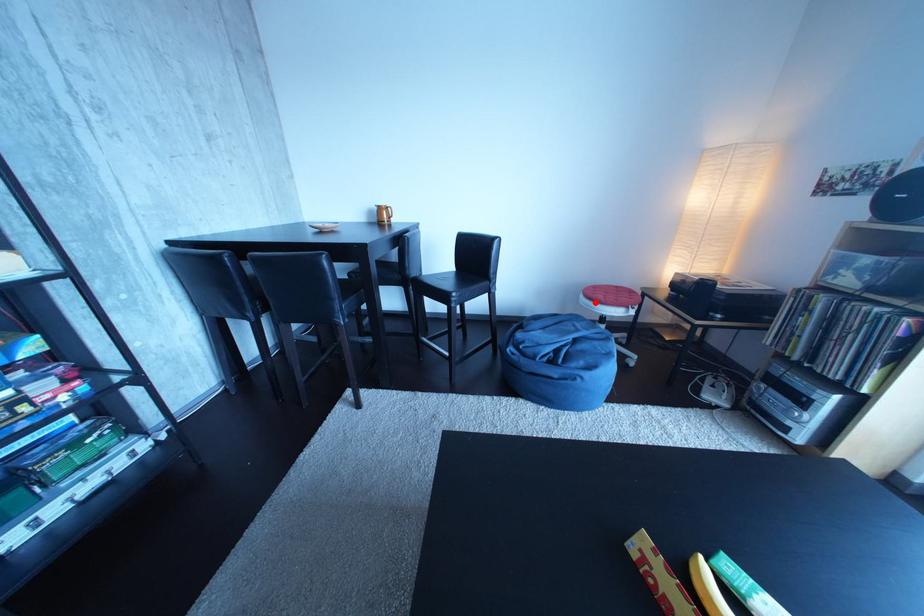
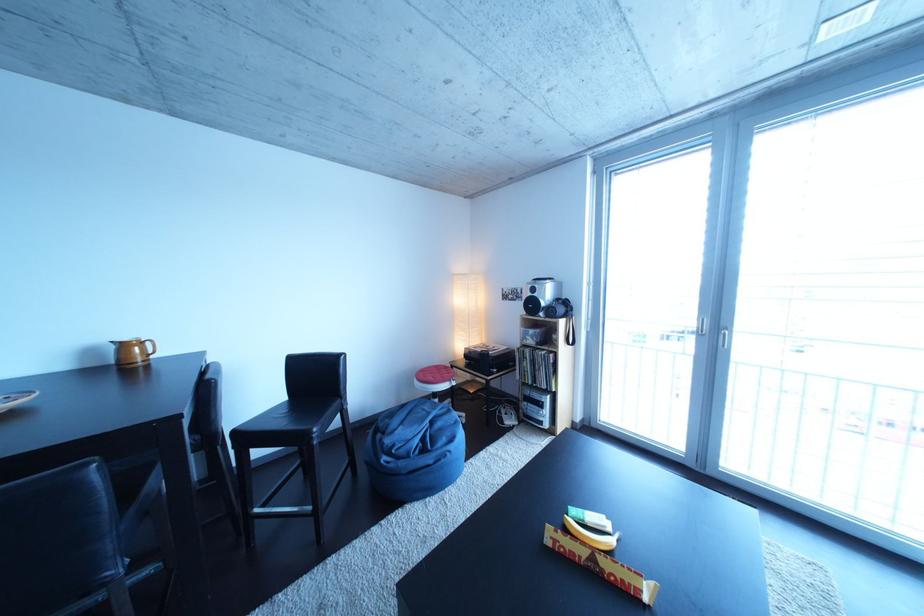
Question: I am providing you with two images of the same scene from different viewpoints. A red point is shown in image1. For the corresponding object point in image2, is it positioned nearer or farther from the camera?

Choices:
 (A) Nearer
 (B) Farther

Answer: (B)